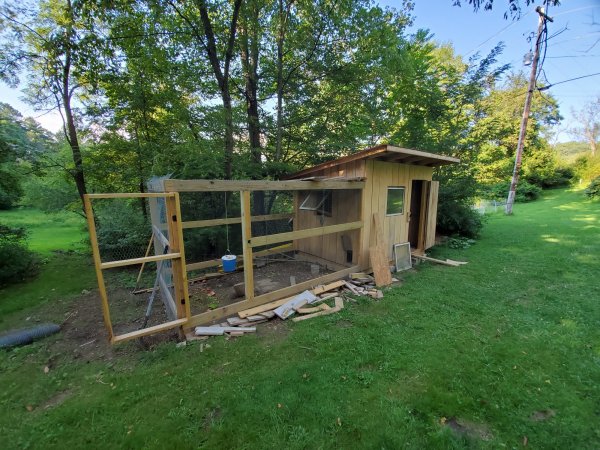
Identify the location of 2 windows. (395, 195), (325, 202).